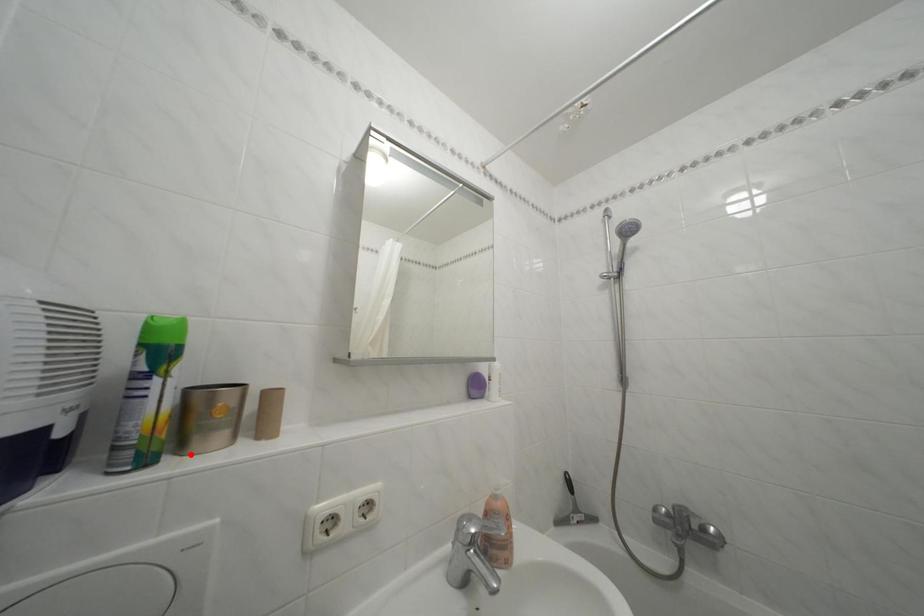
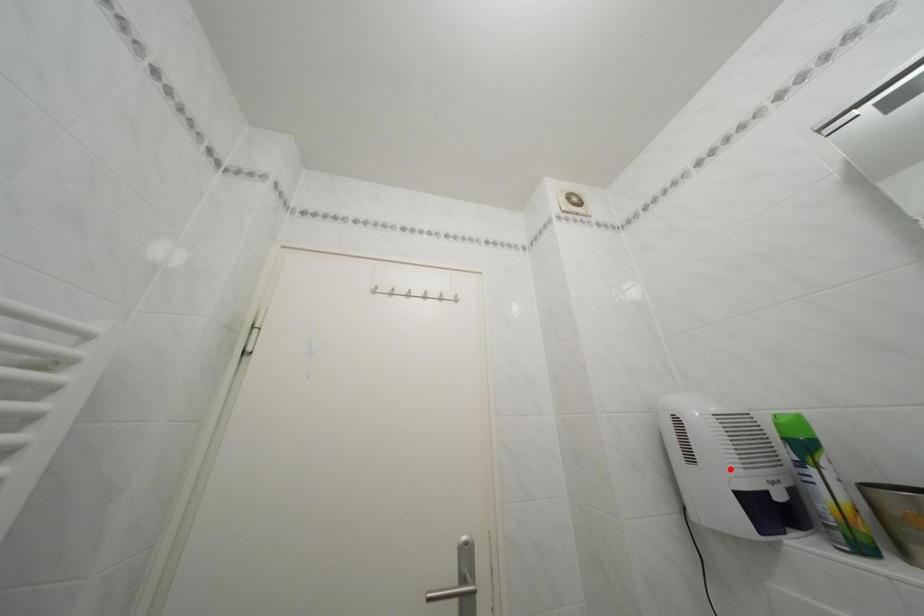
I am providing you with two images of the same scene from different viewpoints. A red point is marked on the first image and another point is marked on the second image. Do the highlighted points in image1 and image2 indicate the same real-world spot?

No